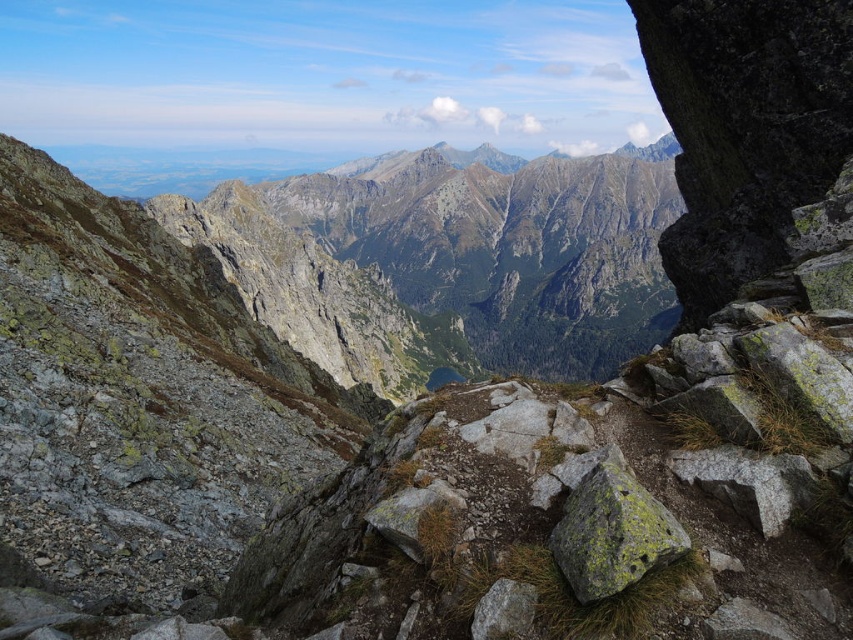
Question: Which point appears closest to the camera in this image?

Choices:
 (A) (570, 502)
 (B) (494, 618)

Answer: (B)

Question: Does green mossy rock at lower right have a smaller size compared to gray rough rock at lower center?

Choices:
 (A) no
 (B) yes

Answer: (A)

Question: Is green mossy rock at lower right above gray rough rock at lower center?

Choices:
 (A) no
 (B) yes

Answer: (B)

Question: Which point is closer to the camera?

Choices:
 (A) gray rough rock at lower center
 (B) green mossy rock at lower right

Answer: (B)

Question: Does green mossy rock at lower right have a lesser width compared to gray rough rock at lower center?

Choices:
 (A) yes
 (B) no

Answer: (B)

Question: Which point appears closest to the camera in this image?

Choices:
 (A) (676, 529)
 (B) (506, 628)

Answer: (B)